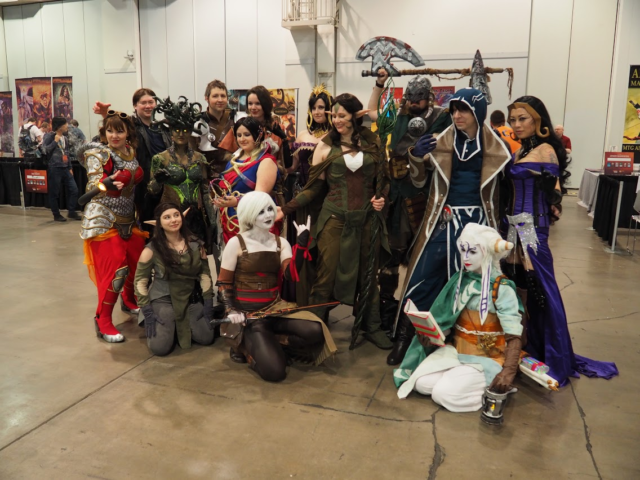
Find the location of `table`. table is located at coordinates (10, 163).